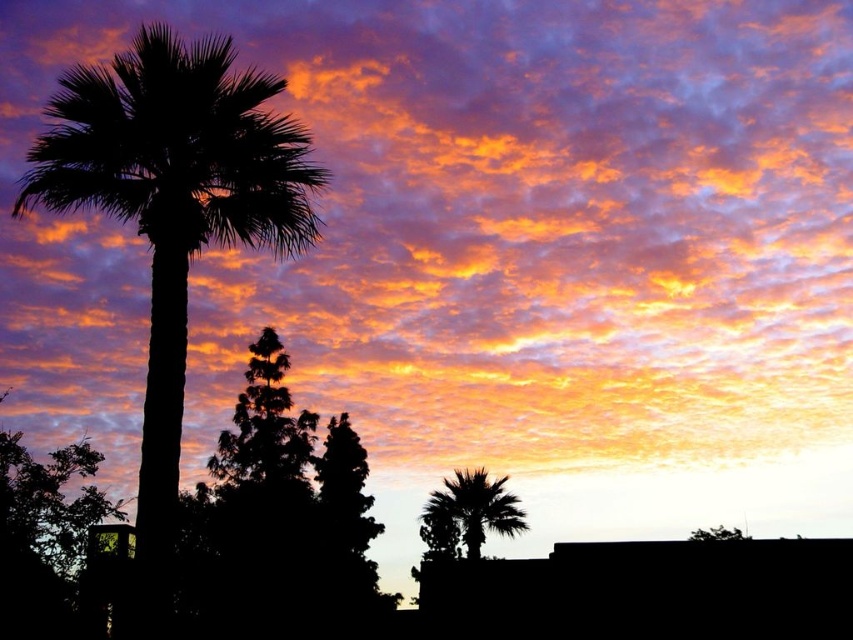
In the scene shown: You are an artist trying to sketch this sunset scene. You notice two silhouette palm trees in the foreground. Which palm tree, the silhouette palm tree at left or the silhouette palm tree at lower right, appears closer to the horizon line?

The silhouette palm tree at lower right appears closer to the horizon line because it is positioned lower in the image compared to the silhouette palm tree at left, which is higher up.